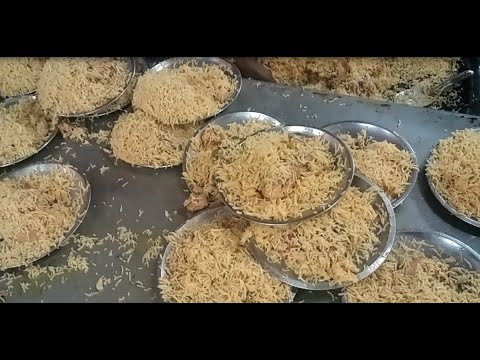
Where is `flat top cook surface (?)`? flat top cook surface (?) is located at coordinates (146, 185), (412, 214), (287, 109).